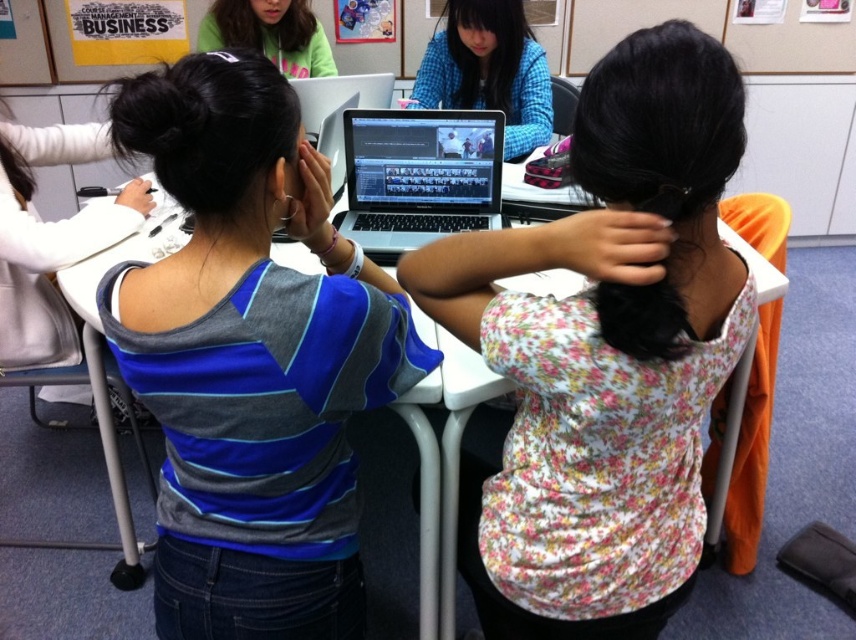
In the scene shown: You are a photographer in the classroom and want to take a photo of the blue plaid shirt at center and the matte green hoodie at upper left. Which one will appear larger in the photo?

The blue plaid shirt at center will appear larger in the photo because it is much taller than the matte green hoodie at upper left.

You are a student trying to locate your missing pen. You remember leaving it on the desk near the blue plaid shirt at center and the matte green hoodie at upper left. Based on their positions, which object is closer to your pen?

The blue plaid shirt at center is positioned under the matte green hoodie at upper left, so the pen is closer to the blue plaid shirt at center.

You are a photographer in the classroom and want to take a photo of the blue plaid shirt at center and the satin black laptop at center. Which object should you focus on if you want to capture both clearly in the same frame?

The blue plaid shirt at center is larger in size compared to the satin black laptop at center, so you should focus on the blue plaid shirt at center to ensure both are in focus.